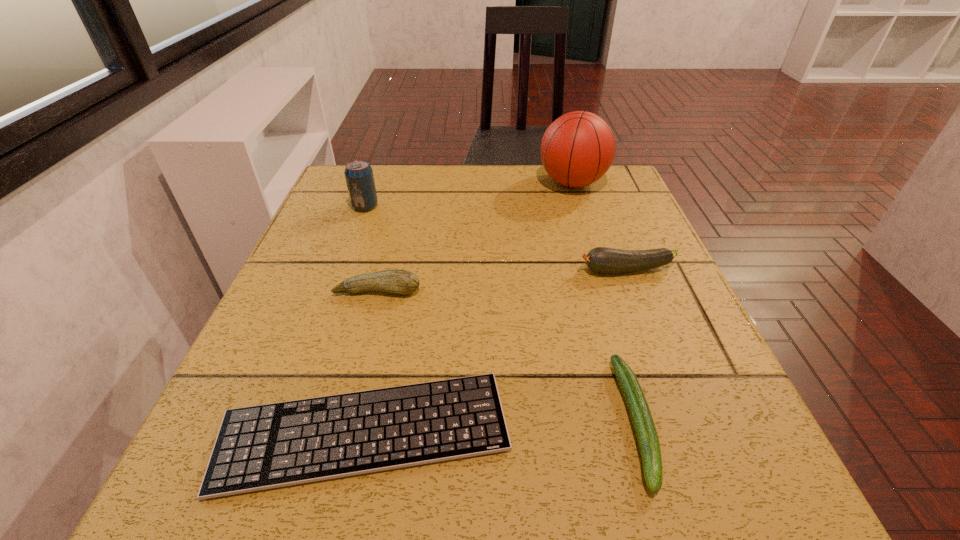
You are a GUI agent. You are given a task and a screenshot of the screen. Output one action in this format:
    pyautogui.click(x=<x>, y=<y>)
    Task: Click on the zucchini that is at the left edge
    The width and height of the screenshot is (960, 540).
    Given the screenshot: What is the action you would take?
    pyautogui.click(x=399, y=281)

Where is `computer keyboard that is at the left edge`? This screenshot has height=540, width=960. computer keyboard that is at the left edge is located at coordinates (x=267, y=446).

Locate an element on the screen. basketball that is at the right edge is located at coordinates click(577, 149).

Identify the location of object that is at the far left corner. (359, 177).

Where is `object positioned at the near left corner`? The image size is (960, 540). object positioned at the near left corner is located at coordinates (267, 446).

The height and width of the screenshot is (540, 960). What are the coordinates of `object situated at the far right corner` in the screenshot? It's located at (577, 149).

Where is `object that is at the near right corner`? This screenshot has width=960, height=540. object that is at the near right corner is located at coordinates (646, 433).

Image resolution: width=960 pixels, height=540 pixels. I want to click on vacant space at the far edge of the desktop, so click(492, 192).

Identify the location of free space at the near edge of the desktop. (505, 491).

Where is `free space at the left edge of the desktop`? This screenshot has height=540, width=960. free space at the left edge of the desktop is located at coordinates (372, 216).